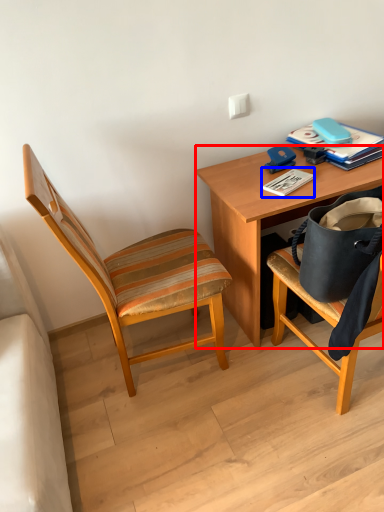
Question: Which point is further to the camera, desk (highlighted by a red box) or paperback book (highlighted by a blue box)?

Choices:
 (A) desk
 (B) paperback book

Answer: (B)